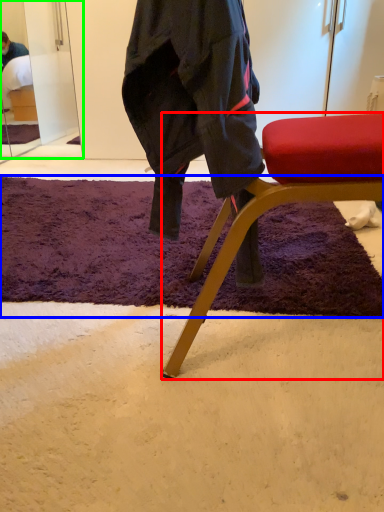
Question: Based on their relative distances, which object is farther from chair (highlighted by a red box)? Choose from mat (highlighted by a blue box) and mirror (highlighted by a green box).

Choices:
 (A) mat
 (B) mirror

Answer: (B)